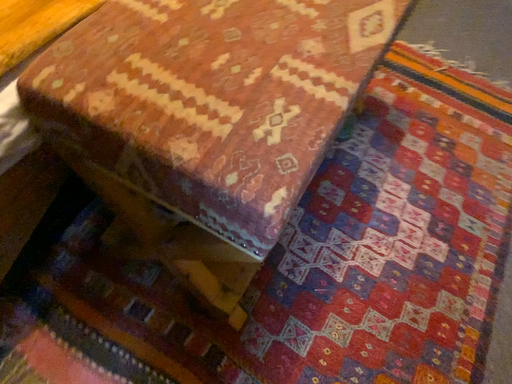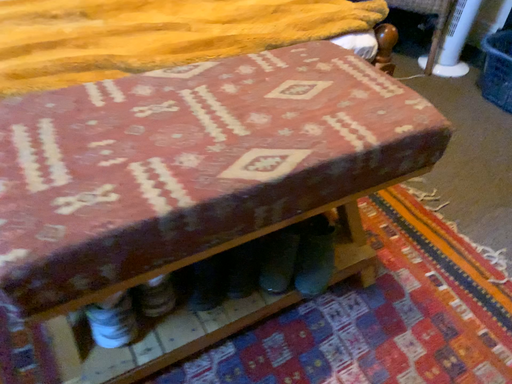
Question: Which way did the camera rotate in the video?

Choices:
 (A) rotated right
 (B) rotated left

Answer: (B)